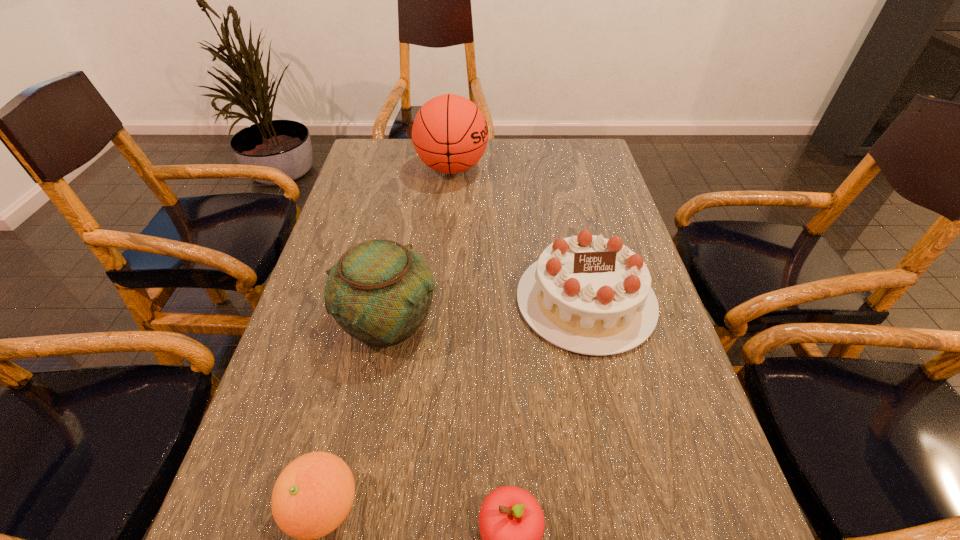
Where is `free space at the far edge of the desktop`? Image resolution: width=960 pixels, height=540 pixels. free space at the far edge of the desktop is located at coordinates (488, 153).

The height and width of the screenshot is (540, 960). In the image, there is a desktop. What are the coordinates of `free space at the left edge` in the screenshot? It's located at (390, 190).

Where is `vacant space at the right edge`? This screenshot has width=960, height=540. vacant space at the right edge is located at coordinates (706, 517).

The width and height of the screenshot is (960, 540). In the image, there is a desktop. What are the coordinates of `vacant space at the far left corner` in the screenshot? It's located at (405, 160).

Where is `free space at the far right corner of the desktop`? This screenshot has width=960, height=540. free space at the far right corner of the desktop is located at coordinates coord(577,159).

Find the location of `free spot between the second tallest object and the basketball`. free spot between the second tallest object and the basketball is located at coordinates (x=420, y=244).

Locate an element on the screen. free space that is in between the fourth shortest object and the basketball is located at coordinates (420, 244).

Identify the location of vacant area that lies between the basketball and the pottery. (420, 244).

Where is `free space between the third tallest object and the pottery`? free space between the third tallest object and the pottery is located at coordinates (487, 310).

Select which object appears as the third closest to the basketball. Please provide its 2D coordinates. Your answer should be formatted as a tuple, i.e. [(x, y)], where the tuple contains the x and y coordinates of a point satisfying the conditions above.

[(312, 496)]